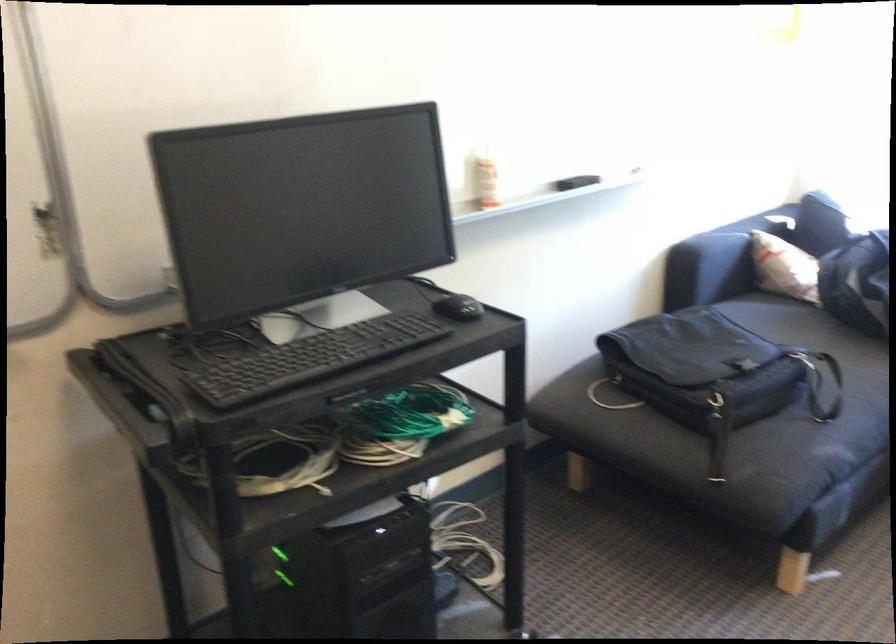
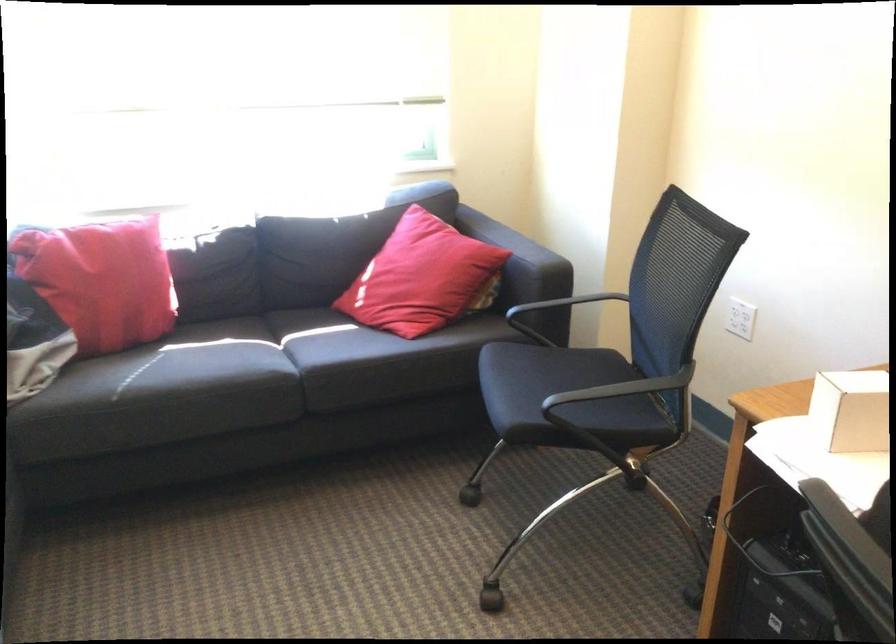
Question: How did the camera likely rotate?

Choices:
 (A) Left
 (B) Right
 (C) Up
 (D) Down

Answer: (B)